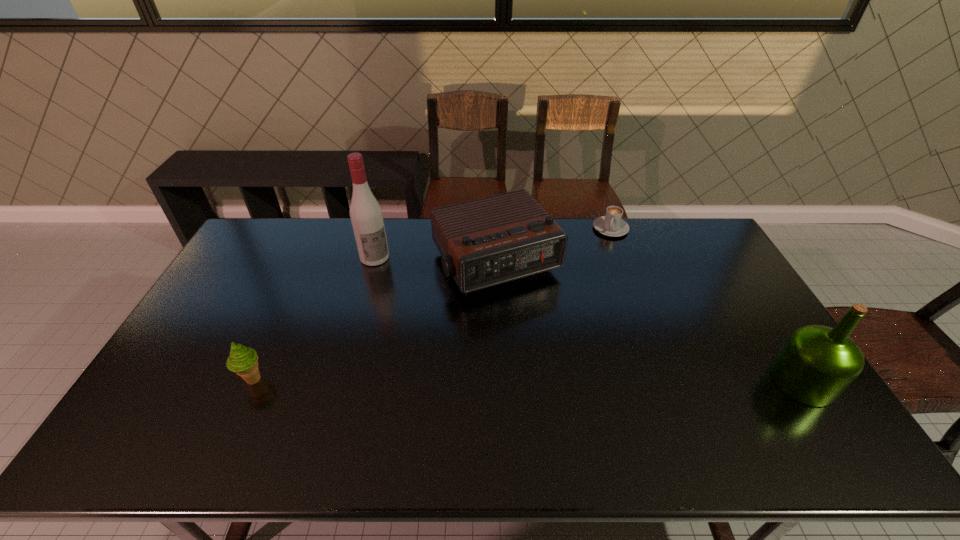
This screenshot has width=960, height=540. What are the coordinates of `the closest object to the olive oil` in the screenshot? It's located at (489, 241).

Where is `free space that satisfies the following two spatial constraints: 1. on the front side of the fourth object from right to left; 2. on the right side of the second tallest object`? The image size is (960, 540). free space that satisfies the following two spatial constraints: 1. on the front side of the fourth object from right to left; 2. on the right side of the second tallest object is located at coordinates (341, 381).

Image resolution: width=960 pixels, height=540 pixels. I want to click on vacant position in the image that satisfies the following two spatial constraints: 1. on the back side of the cappuccino; 2. on the left side of the third object from left to right, so click(x=494, y=228).

Locate an element on the screen. vacant area in the image that satisfies the following two spatial constraints: 1. on the front side of the icecream; 2. on the left side of the olive oil is located at coordinates (252, 381).